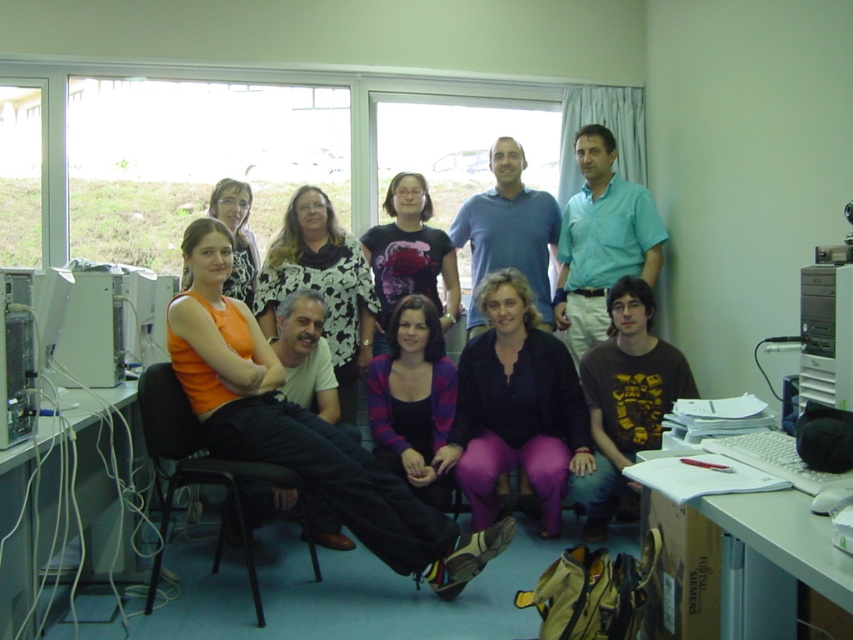
You are standing at the point labeled point (x=509, y=349) in a room. You want to take a photo of the entire group of people in the image. Since the camera is 3.55 meters away from you, will you be able to capture everyone in the photo without moving the camera?

The camera is 3.55 meters away from point (x=509, y=349). Since the group is gathered in the room with the camera positioned at that distance, it is likely that the camera can capture the entire group if they are within the camera lens field of view. However, without knowing the camera lens specifications, it is impossible to determine for sure.